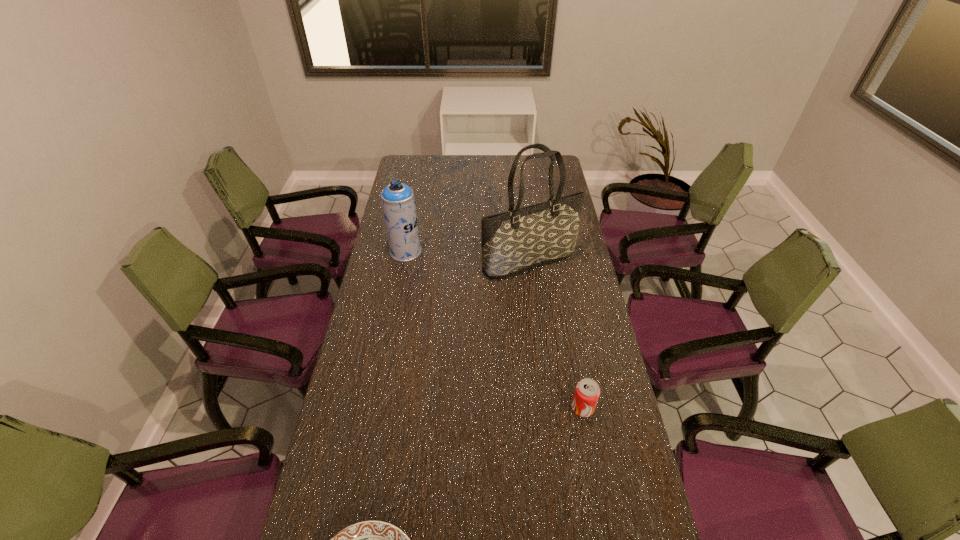
At what (x,y) coordinates should I click in order to perform the action: click on tote bag. Please return your answer as a coordinate pair (x, y). This screenshot has width=960, height=540. Looking at the image, I should click on (523, 238).

Identify the location of aerosol can. The width and height of the screenshot is (960, 540). (398, 202).

You are a GUI agent. You are given a task and a screenshot of the screen. Output one action in this format:
    pyautogui.click(x=<x>, y=<y>)
    Task: Click on the soda can
    
    Given the screenshot: What is the action you would take?
    pyautogui.click(x=587, y=391)

The height and width of the screenshot is (540, 960). What are the coordinates of `the third tallest object` in the screenshot? It's located at (587, 391).

Find the location of `vacant space located 0.170m on the back of the tote bag`. vacant space located 0.170m on the back of the tote bag is located at coordinates (524, 219).

This screenshot has height=540, width=960. Identify the location of free point located on the back of the aerosol can. (412, 221).

Where is `vacant space situated 0.120m on the back of the second shortest object`? This screenshot has height=540, width=960. vacant space situated 0.120m on the back of the second shortest object is located at coordinates (574, 363).

Find the location of a particular element. The image size is (960, 540). object that is at the left edge is located at coordinates (398, 202).

I want to click on tote bag that is at the right edge, so [x=523, y=238].

Locate an element on the screen. Image resolution: width=960 pixels, height=540 pixels. soda can located in the right edge section of the desktop is located at coordinates (587, 391).